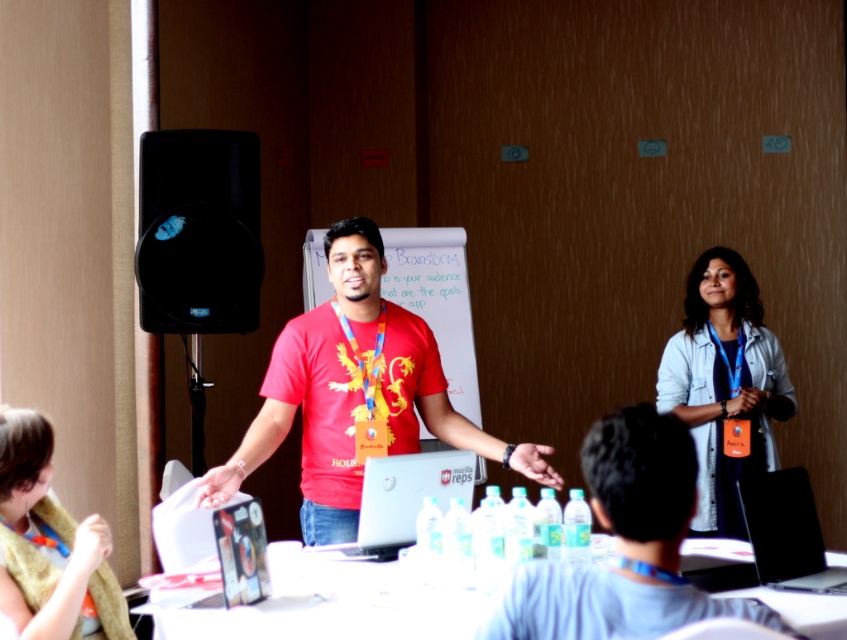
Which is below, red matte t-shirt at center or black glossy laptop at center?

black glossy laptop at center is below.

Is red matte t-shirt at center bigger than black glossy laptop at center?

Correct, red matte t-shirt at center is larger in size than black glossy laptop at center.

The width and height of the screenshot is (847, 640). Describe the element at coordinates (355, 394) in the screenshot. I see `red matte t-shirt at center` at that location.

You are a GUI agent. You are given a task and a screenshot of the screen. Output one action in this format:
    pyautogui.click(x=<x>, y=<y>)
    Task: Click on the red matte t-shirt at center
    The height and width of the screenshot is (640, 847).
    Given the screenshot: What is the action you would take?
    pyautogui.click(x=355, y=394)

Who is higher up, matte red shirt at center or denim jacket at upper right?

denim jacket at upper right is higher up.

What do you see at coordinates (624, 545) in the screenshot? This screenshot has width=847, height=640. I see `matte red shirt at center` at bounding box center [624, 545].

What are the coordinates of `matte red shirt at center` in the screenshot? It's located at (624, 545).

Where is `matte red shirt at center`? Image resolution: width=847 pixels, height=640 pixels. matte red shirt at center is located at coordinates (624, 545).

The height and width of the screenshot is (640, 847). I want to click on matte red shirt at center, so click(624, 545).